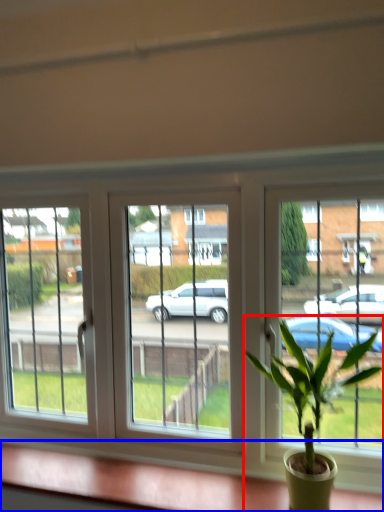
Question: Which of the following is the closest to the observer, houseplant (highlighted by a red box) or window sill (highlighted by a blue box)?

Choices:
 (A) houseplant
 (B) window sill

Answer: (A)